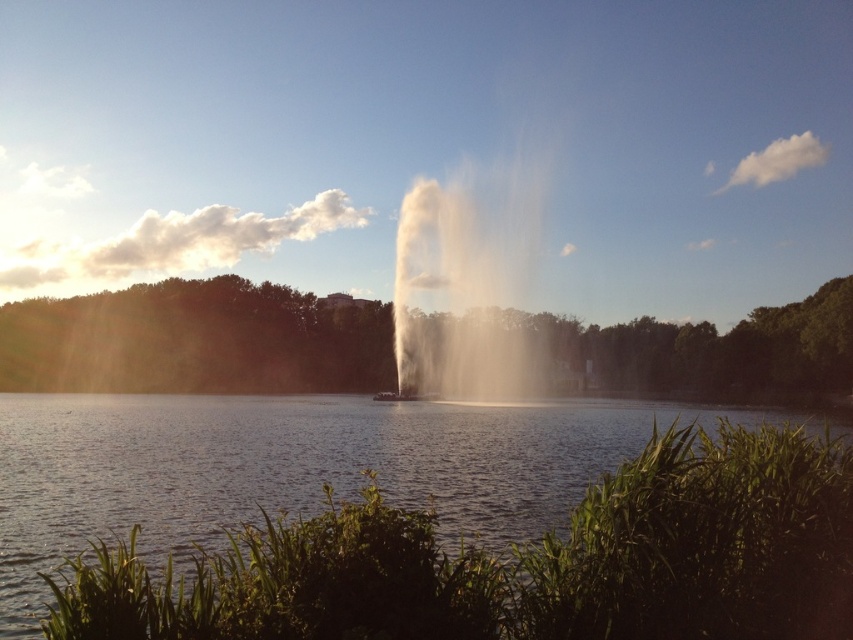
Which is above, transparent water at center or green leafy tree at left?

green leafy tree at left is higher up.

Does point (102, 458) lie in front of point (709, 394)?

Yes, point (102, 458) is closer to viewer.

Does point (38, 410) come behind point (724, 394)?

No.

Identify the location of transparent water at center. (281, 465).

Does green leafy tree at left have a lesser height compared to white misty fountain at center?

Indeed, green leafy tree at left has a lesser height compared to white misty fountain at center.

Does point (94, 310) come closer to viewer compared to point (538, 170)?

Yes.

Identify the location of green leafy tree at left. This screenshot has width=853, height=640. (195, 340).

Is transparent water at center further to the viewer compared to white misty fountain at center?

No.

This screenshot has height=640, width=853. Find the location of `transparent water at center`. transparent water at center is located at coordinates (281, 465).

Find the location of a particular element. The image size is (853, 640). transparent water at center is located at coordinates (281, 465).